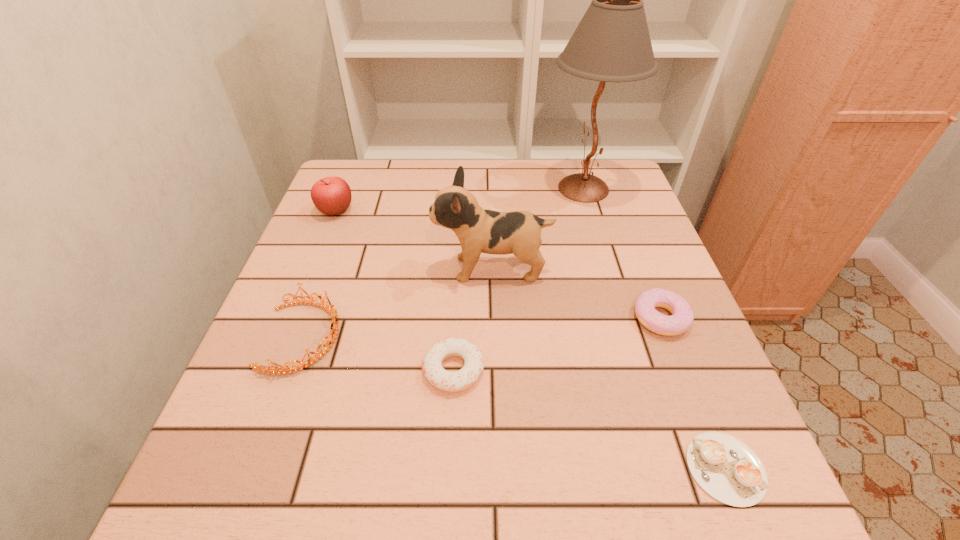
The height and width of the screenshot is (540, 960). Find the location of `free spot located 0.210m on the front-facing side of the tallest object`. free spot located 0.210m on the front-facing side of the tallest object is located at coordinates (467, 188).

The width and height of the screenshot is (960, 540). Find the location of `free location located on the front-facing side of the tallest object`. free location located on the front-facing side of the tallest object is located at coordinates click(521, 188).

Identify the location of vacant space situated at the face of the fifth nearest object. The width and height of the screenshot is (960, 540). (340, 269).

Find the location of a particular element. The width and height of the screenshot is (960, 540). vacant space situated 0.230m at the face of the fifth nearest object is located at coordinates (331, 269).

Find the location of `vacant space located 0.140m at the face of the fifth nearest object`. vacant space located 0.140m at the face of the fifth nearest object is located at coordinates (372, 269).

At what (x,y) coordinates should I click in order to perform the action: click on free space located 0.220m on the front of the apple. Please return your answer as a coordinate pair (x, y). Looking at the image, I should click on (306, 285).

I want to click on vacant space located on the front-facing side of the fourth shortest object, so click(540, 337).

The height and width of the screenshot is (540, 960). I want to click on vacant space located on the back of the farther doughnut, so click(x=627, y=232).

The height and width of the screenshot is (540, 960). I want to click on vacant space located 0.280m on the left of the left doughnut, so click(x=267, y=370).

Where is `free space located on the left of the cappuccino`? This screenshot has width=960, height=540. free space located on the left of the cappuccino is located at coordinates (648, 468).